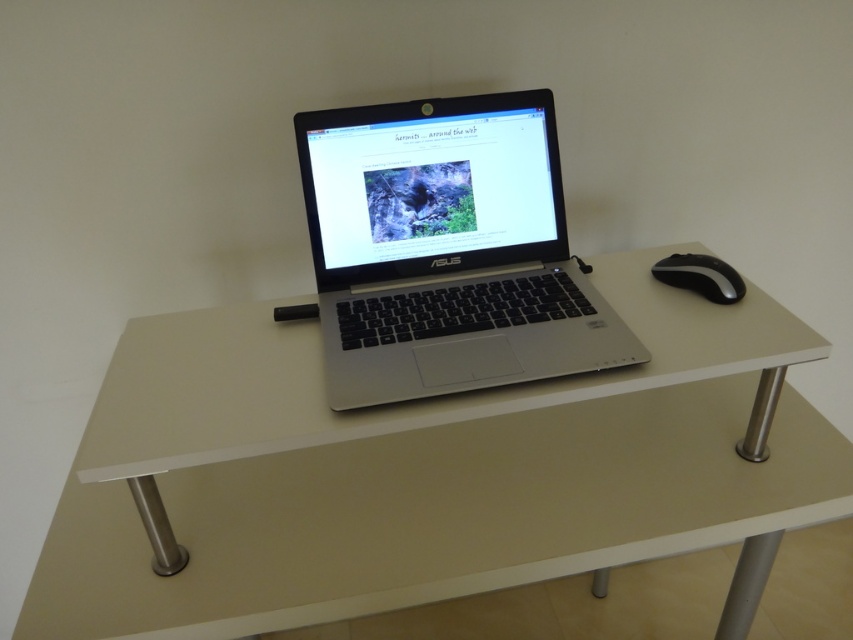
Question: Which object appears closest to the camera in this image?

Choices:
 (A) silver metallic laptop at center
 (B) white glossy table at center
 (C) black rubberized mouse at right

Answer: (B)

Question: Which object appears farthest from the camera in this image?

Choices:
 (A) silver metallic laptop at center
 (B) black rubberized mouse at right
 (C) white glossy table at center

Answer: (B)

Question: Among these objects, which one is nearest to the camera?

Choices:
 (A) white glossy table at center
 (B) silver metallic laptop at center

Answer: (A)

Question: Is silver metallic laptop at center above black rubberized mouse at right?

Choices:
 (A) no
 (B) yes

Answer: (B)

Question: Can you confirm if silver metallic laptop at center is positioned above black rubberized mouse at right?

Choices:
 (A) no
 (B) yes

Answer: (B)

Question: Is silver metallic laptop at center closer to camera compared to black rubberized mouse at right?

Choices:
 (A) no
 (B) yes

Answer: (B)